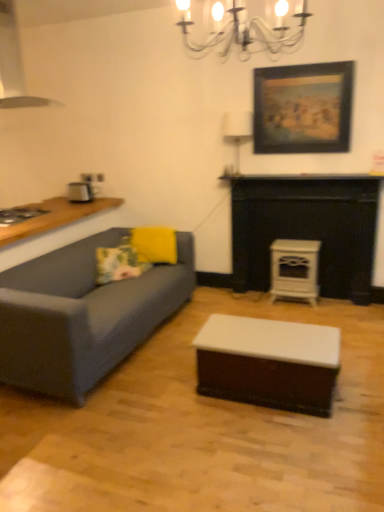
Identify the location of space that is in front of metallic silver toaster at left, the first appliance positioned from the left. The width and height of the screenshot is (384, 512). (80, 203).